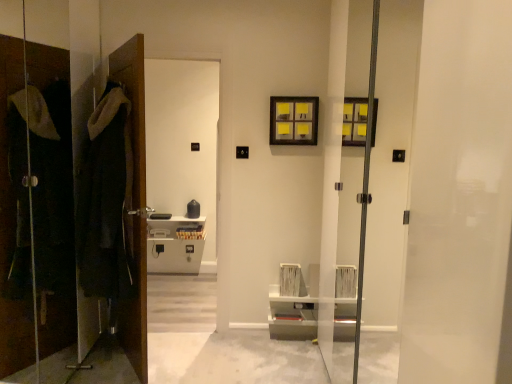
Question: Which is correct: dark woolen robe at left is inside wooden picture frame at upper center, or outside of it?

Choices:
 (A) outside
 (B) inside

Answer: (A)

Question: Is dark woolen robe at left bigger or smaller than wooden picture frame at upper center?

Choices:
 (A) big
 (B) small

Answer: (A)

Question: Which object is positioned farthest from the matte black coat at left?

Choices:
 (A) brown wooden door at left
 (B) dark woolen robe at left
 (C) wooden picture frame at upper center

Answer: (C)

Question: Based on their relative distances, which object is farther from the matte black coat at left?

Choices:
 (A) dark woolen robe at left
 (B) brown wooden door at left
 (C) wooden picture frame at upper center

Answer: (C)